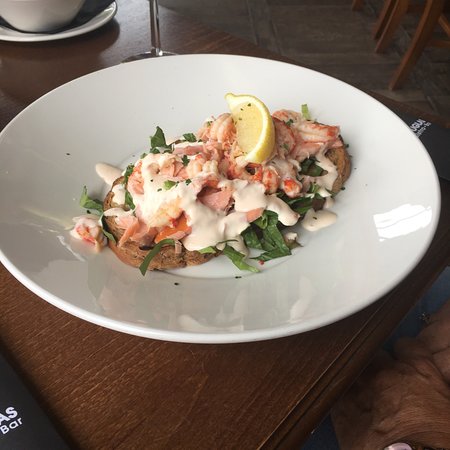
Locate an element on the screen. table is located at coordinates click(250, 430).